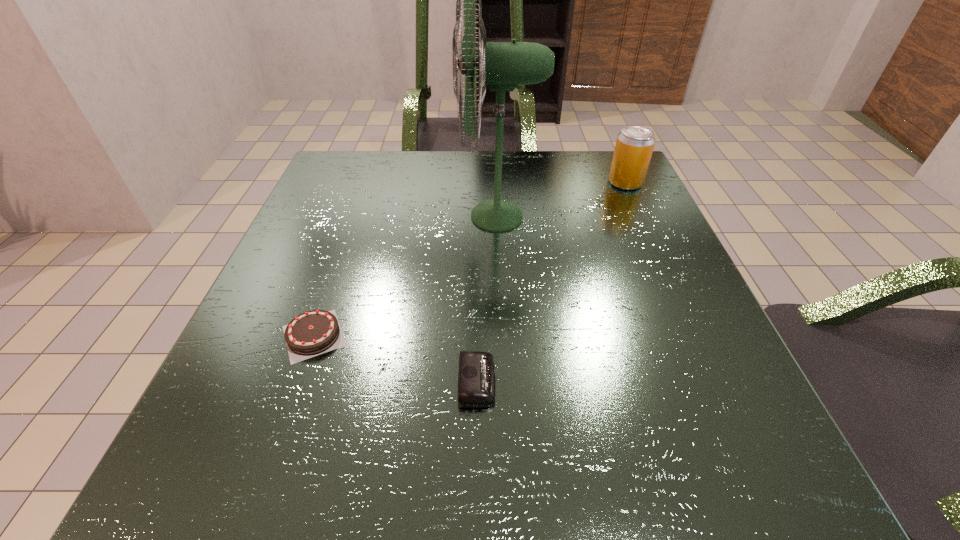
Find the location of a particular element. The image size is (960, 540). unoccupied position between the alarm clock and the tallest object is located at coordinates (488, 299).

The width and height of the screenshot is (960, 540). In order to click on vacant area that lies between the tallest object and the shortest object in this screenshot , I will do `click(488, 299)`.

Where is `free spot between the pop (soda) and the second shortest object`? The height and width of the screenshot is (540, 960). free spot between the pop (soda) and the second shortest object is located at coordinates (469, 259).

Point out which object is positioned as the third nearest to the leftmost object. Please provide its 2D coordinates. Your answer should be formatted as a tuple, i.e. [(x, y)], where the tuple contains the x and y coordinates of a point satisfying the conditions above.

[(634, 146)]

Locate an element on the screen. object that stands as the third closest to the pop (soda) is located at coordinates (315, 332).

Image resolution: width=960 pixels, height=540 pixels. Identify the location of free space that satisfies the following two spatial constraints: 1. on the front side of the second tallest object; 2. on the display of the alarm clock. (716, 381).